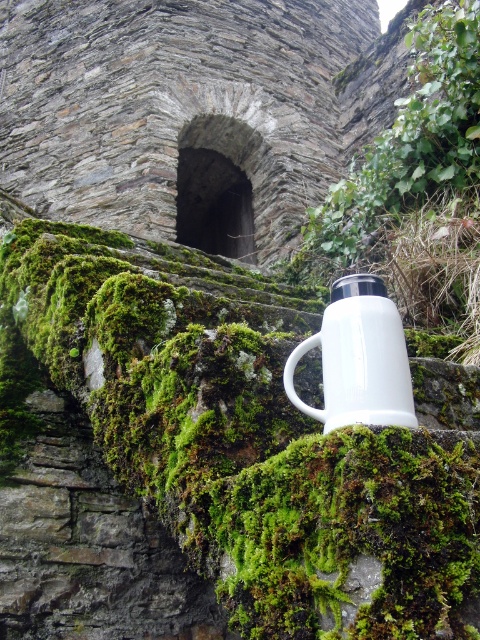
Is green mossy stone at upper center smaller than white enamel mug at center?

No, green mossy stone at upper center is not smaller than white enamel mug at center.

Who is taller, green mossy stone at upper center or white enamel mug at center?

With more height is green mossy stone at upper center.

What do you see at coordinates (224, 451) in the screenshot? I see `green mossy stone at upper center` at bounding box center [224, 451].

This screenshot has width=480, height=640. I want to click on green mossy stone at upper center, so click(x=224, y=451).